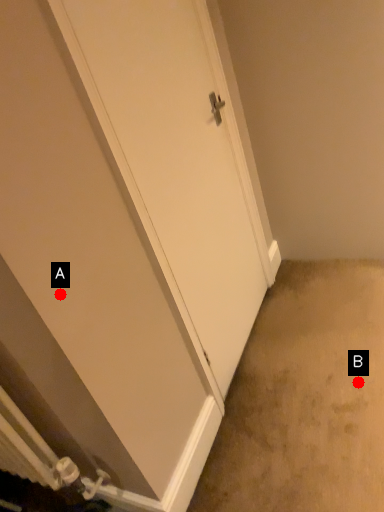
Question: Two points are circled on the image, labeled by A and B beside each circle. Which point appears farthest from the camera in this image?

Choices:
 (A) A is further
 (B) B is further

Answer: (B)